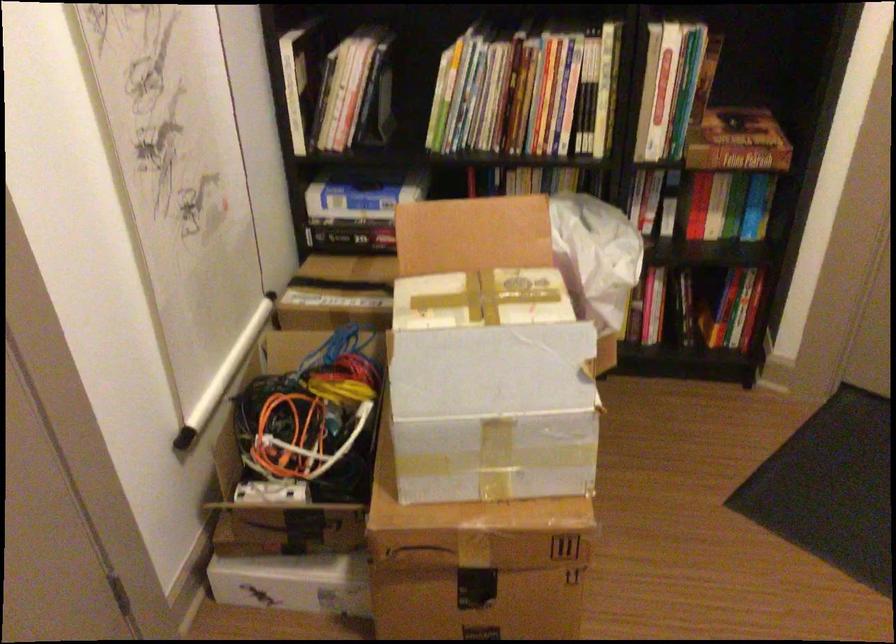
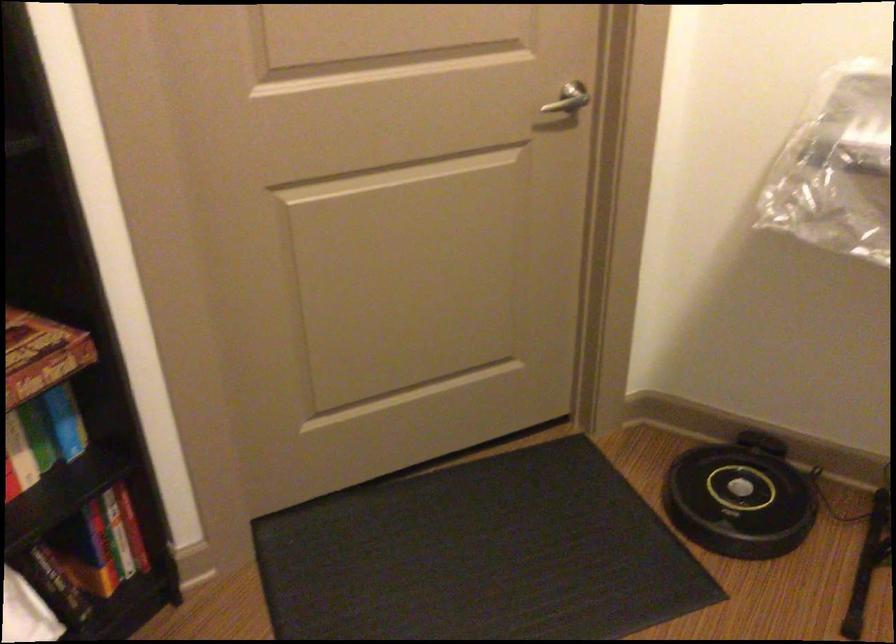
Question: The camera is either moving clockwise (left) or counter-clockwise (right) around the object. The first image is from the beginning of the video and the second image is from the end. Is the camera moving left or right when shooting the video?

Choices:
 (A) Left
 (B) Right

Answer: (A)